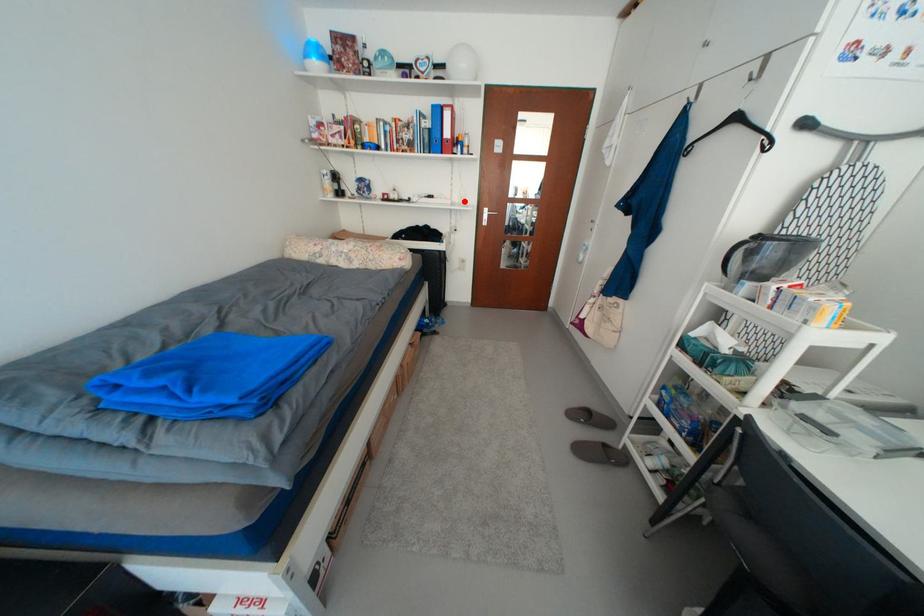
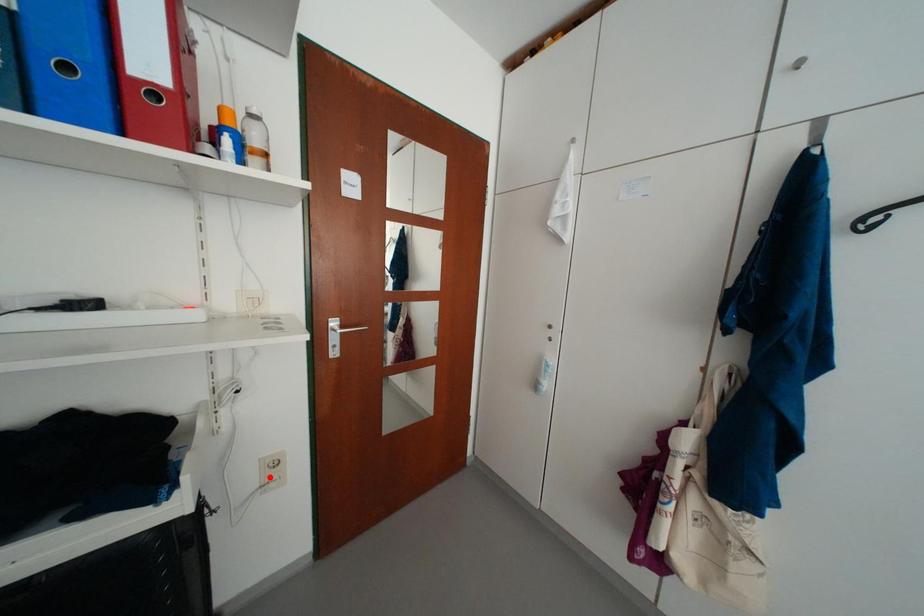
I am providing you with two images of the same scene from different viewpoints. A red point is marked on the first image and another point is marked on the second image. Do the highlighted points in image1 and image2 indicate the same real-world spot?

No